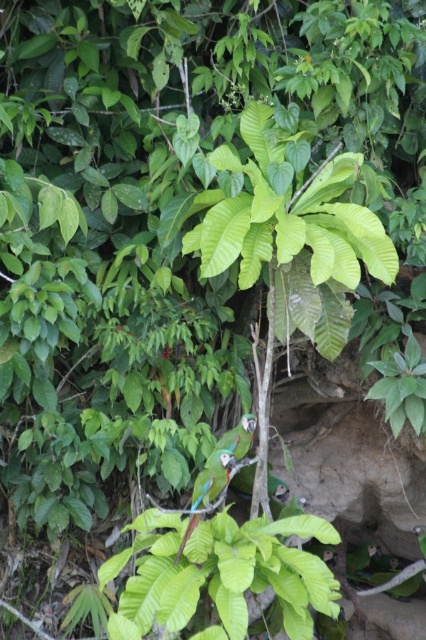
Can you confirm if green glossy parrot at center is positioned to the left of shiny green parrot at center?

Incorrect, green glossy parrot at center is not on the left side of shiny green parrot at center.

Based on the photo, does green glossy parrot at center lie in front of shiny green parrot at center?

That is False.

You are a GUI agent. You are given a task and a screenshot of the screen. Output one action in this format:
    pyautogui.click(x=<x>, y=<y>)
    Task: Click on the green glossy parrot at center
    Image resolution: width=426 pixels, height=640 pixels.
    Given the screenshot: What is the action you would take?
    pyautogui.click(x=238, y=436)